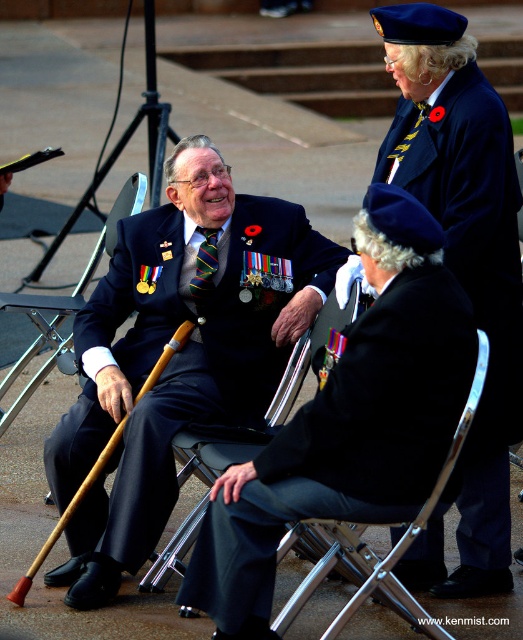
Question: Does black fabric uniform at center appear over striped fabric tie at center?

Choices:
 (A) yes
 (B) no

Answer: (B)

Question: Which point appears closest to the camera in this image?

Choices:
 (A) (120, 193)
 (B) (211, 241)
 (C) (166, 476)

Answer: (C)

Question: Does matte black suit at center come behind black fabric uniform at center?

Choices:
 (A) yes
 (B) no

Answer: (A)

Question: Which object is the closest to the black fabric uniform at center?

Choices:
 (A) wooden cane at lower left
 (B) velvet blue beret at upper right
 (C) matte black suit at center
 (D) striped fabric tie at center

Answer: (B)

Question: Is matte black suit at center wider than black fabric uniform at center?

Choices:
 (A) yes
 (B) no

Answer: (A)

Question: Which is nearer to the wooden cane at lower left?

Choices:
 (A) striped fabric tie at center
 (B) black fabric uniform at center

Answer: (A)